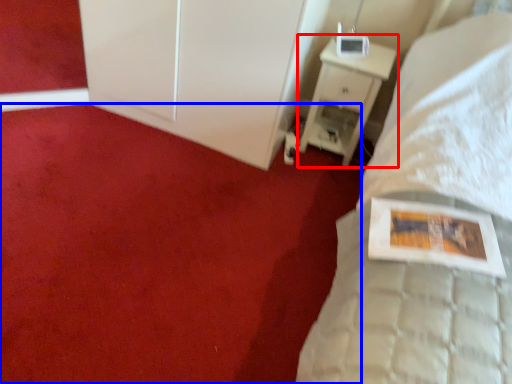
Question: Which of the following is the farthest to the observer, nightstand (highlighted by a red box) or plain (highlighted by a blue box)?

Choices:
 (A) nightstand
 (B) plain

Answer: (A)